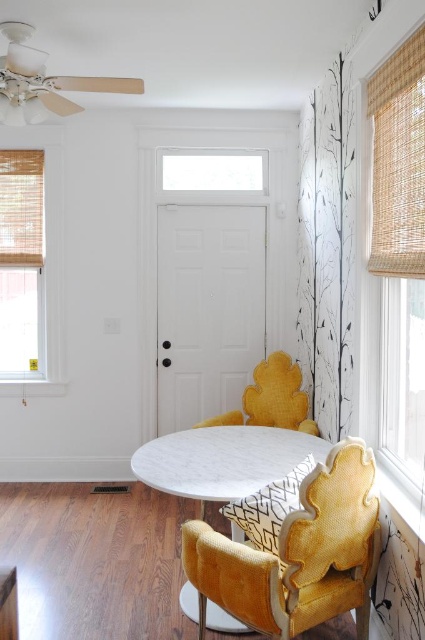
Who is taller, bamboo blind at left or velvet yellow chair at center?

bamboo blind at left is taller.

Can you confirm if bamboo blind at left is positioned to the left of velvet yellow chair at center?

Indeed, bamboo blind at left is positioned on the left side of velvet yellow chair at center.

Who is more distant from viewer, (17, 332) or (289, 369)?

The point (17, 332) is more distant.

Locate an element on the screen. The image size is (425, 640). bamboo blind at left is located at coordinates (33, 280).

Who is positioned more to the left, woven bamboo shade at right or velvet yellow chair at center?

Positioned to the left is velvet yellow chair at center.

Can you confirm if woven bamboo shade at right is bigger than velvet yellow chair at center?

Yes, woven bamboo shade at right is bigger than velvet yellow chair at center.

The image size is (425, 640). I want to click on woven bamboo shade at right, so click(387, 300).

Identify the location of woven bamboo shade at right. (387, 300).

Find the location of a particular element. woven bamboo shade at right is located at coordinates (387, 300).

Can you confirm if woven bamboo shade at right is positioned to the left of bamboo blind at left?

No, woven bamboo shade at right is not to the left of bamboo blind at left.

Between point (379, 19) and point (51, 182), which one is positioned behind?

Positioned behind is point (51, 182).

At what (x,y) coordinates should I click in order to perform the action: click on woven bamboo shade at right. Please return your answer as a coordinate pair (x, y). This screenshot has height=640, width=425. Looking at the image, I should click on (387, 300).